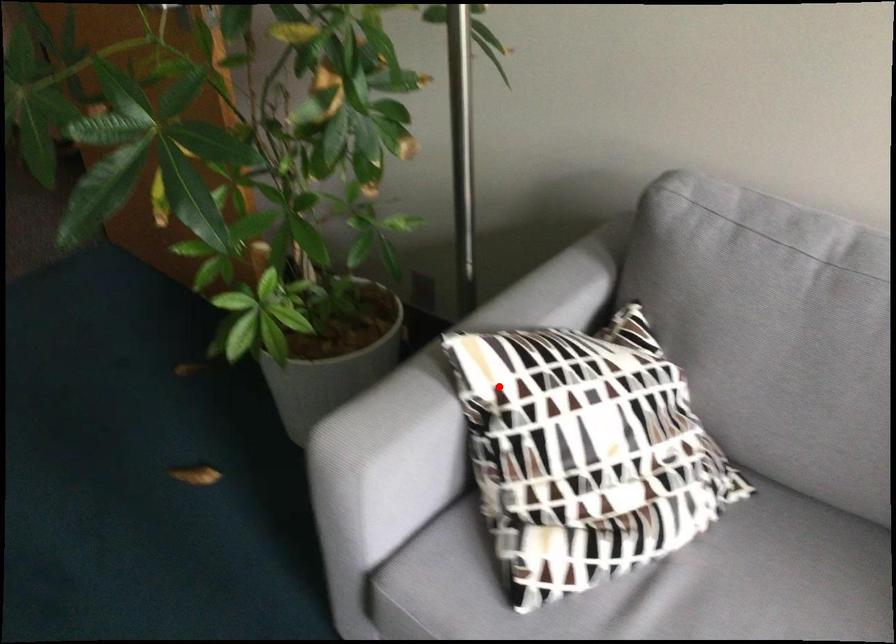
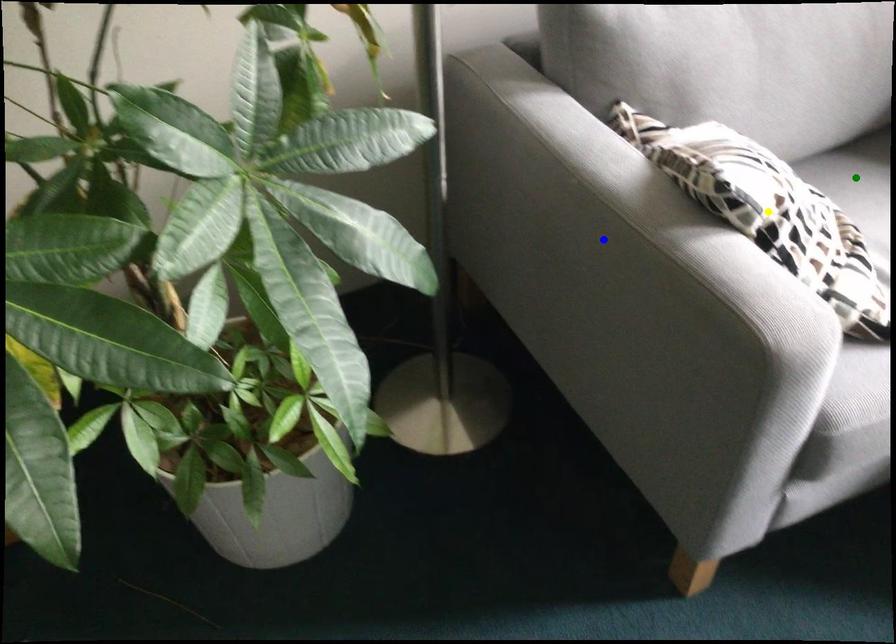
Question: I am providing you with two images of the same scene from different viewpoints. A red point is marked on the first image. You are given multiple points on the second image. Can you choose the point in image 2 that corresponds to the point in image 1?

Choices:
 (A) green point
 (B) blue point
 (C) yellow point

Answer: (C)